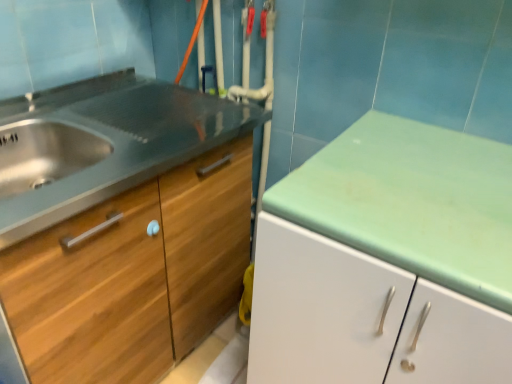
This screenshot has width=512, height=384. What do you see at coordinates (133, 276) in the screenshot? I see `wooden cabinet at left` at bounding box center [133, 276].

I want to click on wooden cabinet at left, so click(133, 276).

Identify the location of wooden drawer at left. The height and width of the screenshot is (384, 512). (84, 267).

Measure the distance between wooden drawer at left and camera.

The distance of wooden drawer at left from camera is 29.72 inches.

Describe the element at coordinates (84, 267) in the screenshot. I see `wooden drawer at left` at that location.

Find the location of a particular element. wooden cabinet at left is located at coordinates (133, 276).

Considering the positions of objects wooden cabinet at left and wooden drawer at left in the image provided, who is more to the left, wooden cabinet at left or wooden drawer at left?

From the viewer's perspective, wooden drawer at left appears more on the left side.

Which object is closer to the camera taking this photo, wooden cabinet at left or wooden drawer at left?

wooden drawer at left is in front.

Is point (180, 267) closer or farther from the camera than point (153, 263)?

Point (180, 267) is positioned farther from the camera compared to point (153, 263).

From the image's perspective, is wooden cabinet at left over wooden drawer at left?

No, from the image's perspective, wooden cabinet at left is not on top of wooden drawer at left.

From a real-world perspective, is wooden cabinet at left below wooden drawer at left?

Yes, from a real-world perspective, wooden cabinet at left is beneath wooden drawer at left.

Considering the relative sizes of wooden cabinet at left and wooden drawer at left in the image provided, is wooden cabinet at left thinner than wooden drawer at left?

No, wooden cabinet at left is not thinner than wooden drawer at left.

Considering the sizes of objects wooden cabinet at left and wooden drawer at left in the image provided, who is taller, wooden cabinet at left or wooden drawer at left?

Standing taller between the two is wooden cabinet at left.

Considering the relative sizes of wooden cabinet at left and wooden drawer at left in the image provided, is wooden cabinet at left bigger than wooden drawer at left?

Yes, wooden cabinet at left is bigger than wooden drawer at left.

Is wooden cabinet at left surrounding wooden drawer at left?

That's correct, wooden drawer at left is inside wooden cabinet at left.

From the picture: Is wooden cabinet at left far from wooden drawer at left?

No, wooden cabinet at left is not far from wooden drawer at left.

Is wooden cabinet at left facing towards wooden drawer at left?

No, wooden cabinet at left is not facing towards wooden drawer at left.

This screenshot has width=512, height=384. Identify the location of drawer above the wooden cabinet at left (from a real-world perspective). 84,267.

Is wooden drawer at left at the left side of wooden cabinet at left?

Yes.

Considering their positions, is wooden drawer at left located in front of or behind wooden cabinet at left?

wooden drawer at left is positioned closer to the viewer than wooden cabinet at left.

Based on the photo, which point is more forward, (124,257) or (20,255)?

The point (20,255) is closer.

From the image's perspective, is wooden drawer at left located above or below wooden cabinet at left?

From the image's perspective, wooden drawer at left appears above wooden cabinet at left.

From a real-world perspective, is wooden drawer at left below wooden cabinet at left?

No.

Can you confirm if wooden drawer at left is wider than wooden cabinet at left?

In fact, wooden drawer at left might be narrower than wooden cabinet at left.

Is wooden drawer at left taller or shorter than wooden cabinet at left?

Clearly, wooden drawer at left is shorter compared to wooden cabinet at left.

Considering the sizes of wooden drawer at left and wooden cabinet at left in the image, is wooden drawer at left bigger or smaller than wooden cabinet at left?

wooden drawer at left is smaller than wooden cabinet at left.

Do you think wooden drawer at left is within wooden cabinet at left, or outside of it?

wooden drawer at left is enclosed within wooden cabinet at left.

Are wooden drawer at left and wooden cabinet at left making contact?

Yes, wooden drawer at left is next to wooden cabinet at left.

Is wooden drawer at left positioned with its back to wooden cabinet at left?

Correct, wooden drawer at left is looking away from wooden cabinet at left.

Can you tell me how much wooden drawer at left and wooden cabinet at left differ in facing direction?

The angular difference between wooden drawer at left and wooden cabinet at left is 0.186 degrees.

The height and width of the screenshot is (384, 512). I want to click on cabinetry below the wooden drawer at left (from the image's perspective), so click(x=133, y=276).

The image size is (512, 384). What are the coordinates of `drawer to the left of wooden cabinet at left` in the screenshot? It's located at (84, 267).

I want to click on drawer above the wooden cabinet at left (from the image's perspective), so click(x=84, y=267).